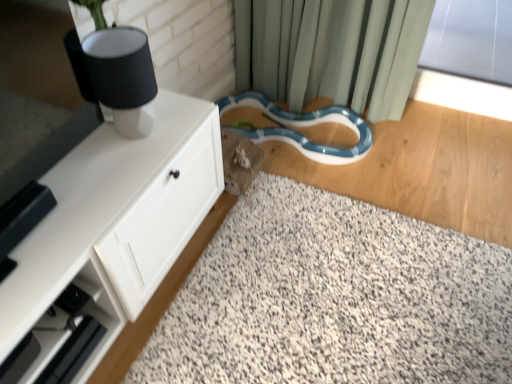
Identify the location of free space on the front side of black matte table lamp at upper left. The image size is (512, 384). (114, 169).